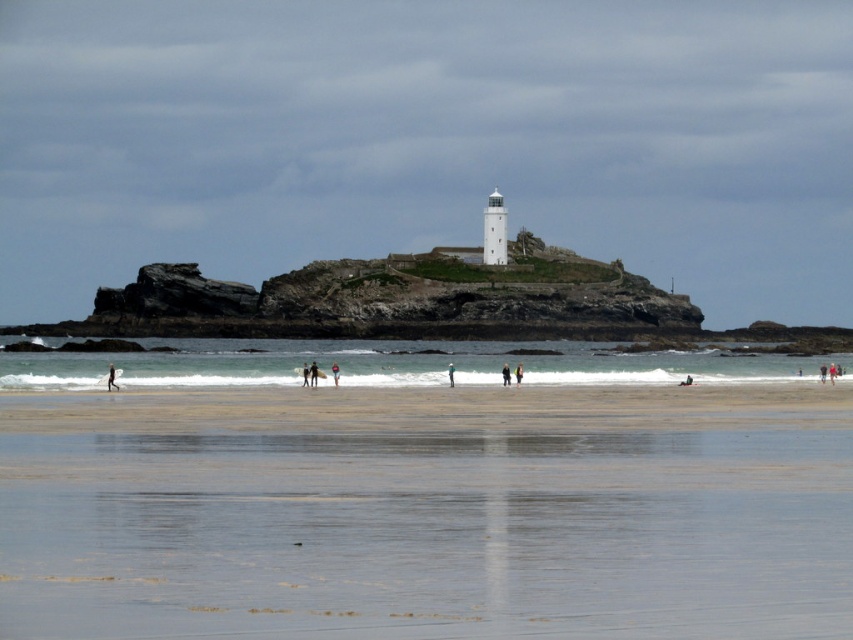
From the picture: You are standing on the beach and want to place your dark brown leather jacket at center without it getting wet. The smooth sand at lower center is the only dry area. Can you fit your jacket there?

The smooth sand at lower center has a larger width than the dark brown leather jacket at center, so yes, it can fit there without getting wet.

You are a hiker who wants to reach the lighthouse on the rocky island. You are currently standing on the smooth sand at lower center. There is a dark blue wetsuit at lower left. Which direction should you move to avoid stepping into the water?

You should move toward the dark blue wetsuit at lower left because the smooth sand at lower center is positioned under it, indicating the wetsuit is on higher ground closer to the island.